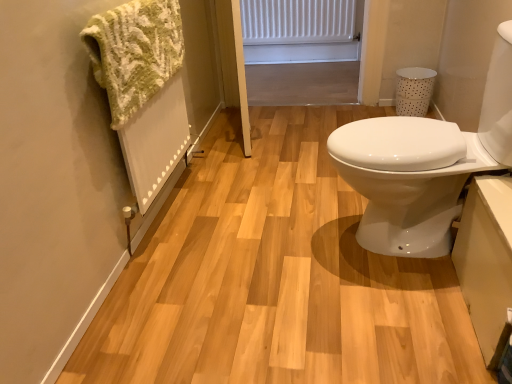
Question: Is green knitted towel at left oriented towards white glossy sink at right?

Choices:
 (A) no
 (B) yes

Answer: (B)

Question: Is green knitted towel at left positioned beyond the bounds of white glossy sink at right?

Choices:
 (A) yes
 (B) no

Answer: (A)

Question: Is green knitted towel at left shorter than white glossy sink at right?

Choices:
 (A) no
 (B) yes

Answer: (B)

Question: Is green knitted towel at left to the left of white glossy sink at right from the viewer's perspective?

Choices:
 (A) yes
 (B) no

Answer: (A)

Question: Is green knitted towel at left beside white glossy sink at right?

Choices:
 (A) yes
 (B) no

Answer: (B)

Question: In the image, is white matte radiator at upper center positioned in front of or behind white glossy sink at right?

Choices:
 (A) front
 (B) behind

Answer: (B)

Question: Considering the positions of white matte radiator at upper center and white glossy sink at right in the image, is white matte radiator at upper center taller or shorter than white glossy sink at right?

Choices:
 (A) tall
 (B) short

Answer: (B)

Question: Considering the relative positions of white matte radiator at upper center and white glossy sink at right in the image provided, is white matte radiator at upper center to the left or to the right of white glossy sink at right?

Choices:
 (A) left
 (B) right

Answer: (A)

Question: Is white matte radiator at upper center inside the boundaries of white glossy sink at right, or outside?

Choices:
 (A) outside
 (B) inside

Answer: (A)

Question: Does point (344, 153) appear closer or farther from the camera than point (117, 44)?

Choices:
 (A) closer
 (B) farther

Answer: (B)

Question: Looking at the image, does white glossy sink at right seem bigger or smaller compared to green knitted towel at left?

Choices:
 (A) big
 (B) small

Answer: (A)

Question: Considering the positions of white glossy sink at right and green knitted towel at left in the image, is white glossy sink at right wider or thinner than green knitted towel at left?

Choices:
 (A) thin
 (B) wide

Answer: (B)

Question: Relative to green knitted towel at left, is white glossy sink at right in front or behind?

Choices:
 (A) behind
 (B) front

Answer: (B)

Question: Visually, is green knitted towel at left positioned to the left or to the right of white glossy sink at right?

Choices:
 (A) right
 (B) left

Answer: (B)

Question: Considering their positions, is green knitted towel at left located in front of or behind white glossy sink at right?

Choices:
 (A) front
 (B) behind

Answer: (B)